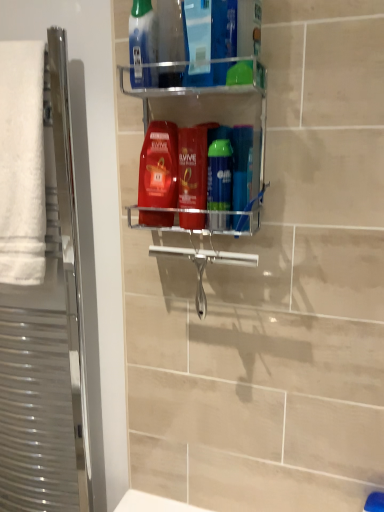
Question: Is silver metallic towel rack at left in front of or behind white soft towel at left in the image?

Choices:
 (A) behind
 (B) front

Answer: (A)

Question: Considering the positions of silver metallic towel rack at left and white soft towel at left in the image, is silver metallic towel rack at left bigger or smaller than white soft towel at left?

Choices:
 (A) big
 (B) small

Answer: (A)

Question: Which object is the farthest from the white soft towel at left?

Choices:
 (A) clear plastic shelf at center
 (B) translucent plastic mouthwash at upper center, placed as the first mouthwash when sorted from left to right
 (C) silver metallic towel rack at left
 (D) shiny red shampoo at center
 (E) blue plastic toothbrush at center, the 4th mouthwash from the left

Answer: (E)

Question: Which object is positioned closest to the green glossy mouthwash at center, which appears as the 2th mouthwash when viewed from the right?

Choices:
 (A) translucent plastic mouthwash at center, the 2th mouthwash when ordered from left to right
 (B) translucent plastic mouthwash at upper center, marked as the 4th mouthwash in a right-to-left arrangement
 (C) shiny red shampoo at center
 (D) white soft towel at left
 (E) blue plastic toothbrush at center, placed as the first mouthwash when sorted from right to left

Answer: (E)